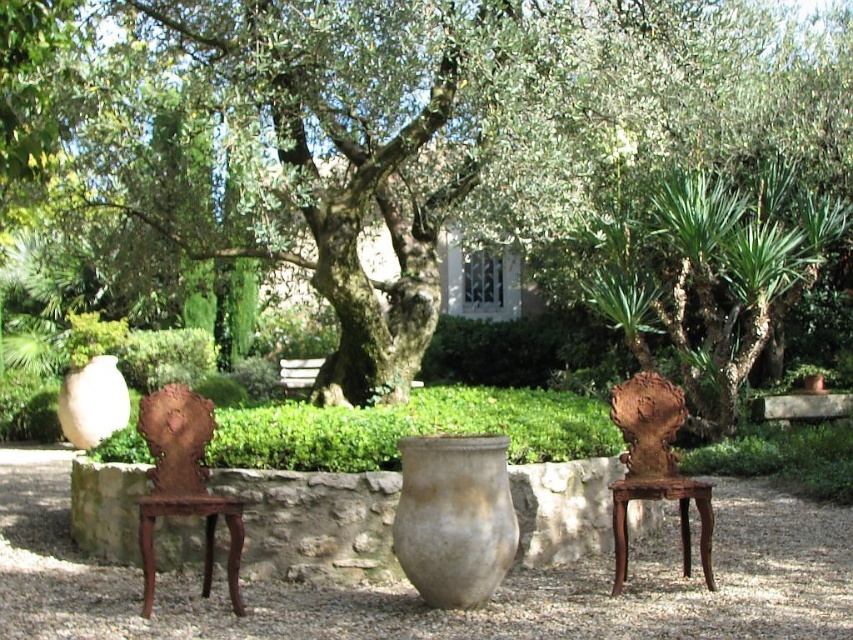
Question: Which of the following is the farthest from the observer?

Choices:
 (A) rustic wood table at center
 (B) matte gray vase at center
 (C) rusty metal sculpture at right
 (D) green leafy tree at center

Answer: (C)

Question: Can you confirm if rusty wood chair at left is bigger than rusty metal sculpture at right?

Choices:
 (A) no
 (B) yes

Answer: (B)

Question: Which of these objects is positioned farthest from the rusty wood chair at left?

Choices:
 (A) matte white vase at left
 (B) rustic wood table at center

Answer: (A)

Question: Does matte gray vase at center appear on the left side of rustic wood table at center?

Choices:
 (A) yes
 (B) no

Answer: (A)

Question: Estimate the real-world distances between objects in this image. Which object is closer to the matte white vase at left?

Choices:
 (A) rustic wood table at center
 (B) matte gray vase at center
 (C) green leafy tree at center

Answer: (C)

Question: Is rusty wood chair at left thinner than rustic wood table at center?

Choices:
 (A) no
 (B) yes

Answer: (A)